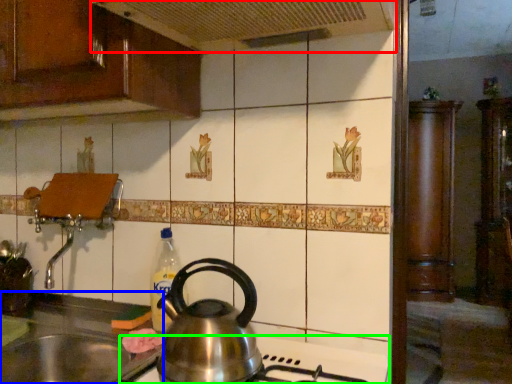
Question: Considering the real-world distances, which object is closest to exhaust hood (highlighted by a red box)? sink (highlighted by a blue box) or gas stove (highlighted by a green box).

Choices:
 (A) sink
 (B) gas stove

Answer: (B)